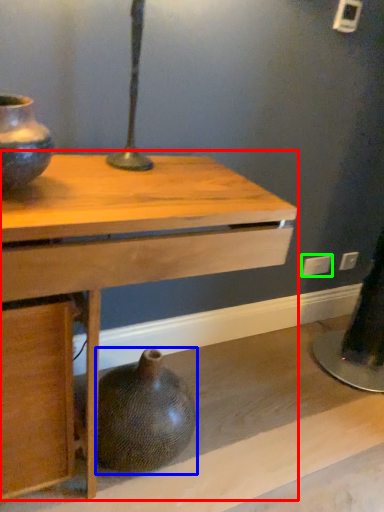
Question: Which is nearer to the table (highlighted by a red box)? vase (highlighted by a blue box) or electric outlet (highlighted by a green box).

Choices:
 (A) vase
 (B) electric outlet

Answer: (A)